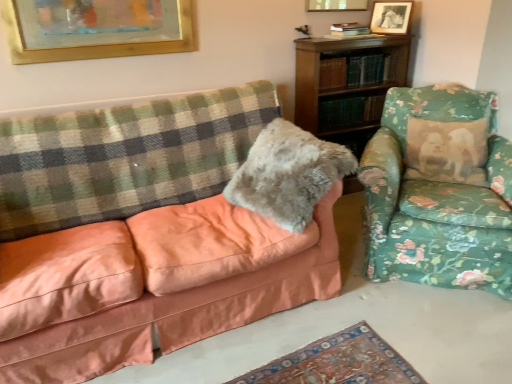
Question: Is floral fabric armchair at right at the back of green checkered blanket at left?

Choices:
 (A) yes
 (B) no

Answer: (B)

Question: Considering the relative positions of green checkered blanket at left and floral fabric armchair at right in the image provided, is green checkered blanket at left to the left of floral fabric armchair at right from the viewer's perspective?

Choices:
 (A) no
 (B) yes

Answer: (B)

Question: Is green checkered blanket at left thinner than floral fabric armchair at right?

Choices:
 (A) yes
 (B) no

Answer: (A)

Question: From a real-world perspective, is green checkered blanket at left below floral fabric armchair at right?

Choices:
 (A) yes
 (B) no

Answer: (B)

Question: Could you tell me if green checkered blanket at left is turned towards floral fabric armchair at right?

Choices:
 (A) yes
 (B) no

Answer: (B)

Question: From the image's perspective, would you say green checkered blanket at left is shown under floral fabric armchair at right?

Choices:
 (A) no
 (B) yes

Answer: (A)

Question: Is the depth of matte peach couch at left greater than that of floral fabric armchair at right?

Choices:
 (A) no
 (B) yes

Answer: (A)

Question: Can you confirm if matte peach couch at left is shorter than floral fabric armchair at right?

Choices:
 (A) no
 (B) yes

Answer: (A)

Question: Can you confirm if matte peach couch at left is wider than floral fabric armchair at right?

Choices:
 (A) yes
 (B) no

Answer: (B)

Question: Would you say matte peach couch at left is a long distance from floral fabric armchair at right?

Choices:
 (A) no
 (B) yes

Answer: (A)

Question: Considering the relative sizes of matte peach couch at left and floral fabric armchair at right in the image provided, is matte peach couch at left taller than floral fabric armchair at right?

Choices:
 (A) no
 (B) yes

Answer: (B)

Question: Does matte peach couch at left come in front of floral fabric armchair at right?

Choices:
 (A) no
 (B) yes

Answer: (B)

Question: Is gold-framed picture at upper center, the 3th picture frame when ordered from right to left, at the back of fuzzy gray pillow at center?

Choices:
 (A) yes
 (B) no

Answer: (B)